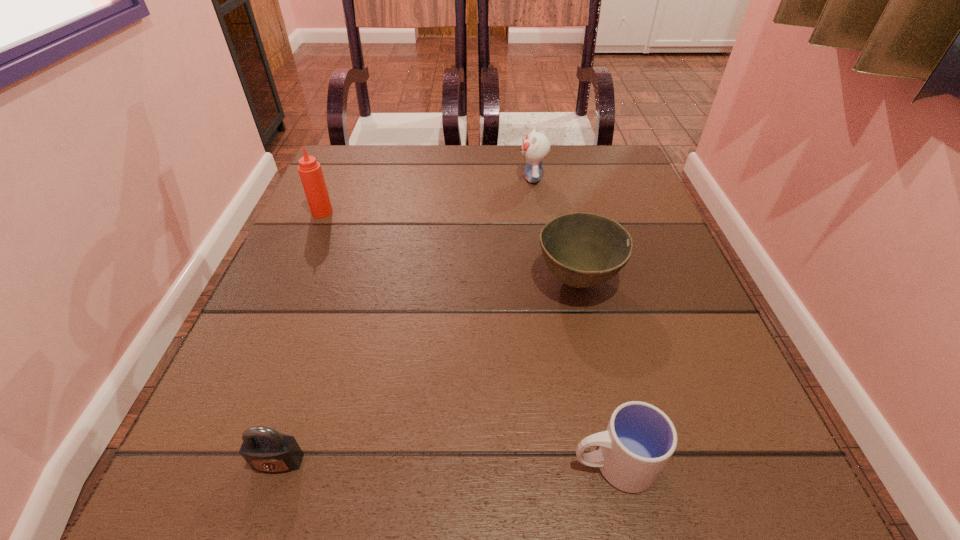
You are a GUI agent. You are given a task and a screenshot of the screen. Output one action in this format:
    pyautogui.click(x=<x>, y=<y>)
    Task: Click on the padlock situated at the left edge
    The image size is (960, 540).
    Given the screenshot: What is the action you would take?
    pyautogui.click(x=264, y=449)

Identify the location of bowl that is positioned at the right edge. The height and width of the screenshot is (540, 960). tap(582, 250).

Identify the location of cup at the right edge. Image resolution: width=960 pixels, height=540 pixels. (640, 439).

You are a GUI agent. You are given a task and a screenshot of the screen. Output one action in this format:
    pyautogui.click(x=<x>, y=<y>)
    Task: Click on the object at the near left corner
    The width and height of the screenshot is (960, 540).
    Given the screenshot: What is the action you would take?
    pyautogui.click(x=264, y=449)

You are a GUI agent. You are given a task and a screenshot of the screen. Output one action in this format:
    pyautogui.click(x=<x>, y=<y>)
    Task: Click on the object present at the near right corner
    Image resolution: width=960 pixels, height=540 pixels.
    Given the screenshot: What is the action you would take?
    pyautogui.click(x=640, y=439)

Where is `vacant space at the far edge of the desktop`? This screenshot has width=960, height=540. vacant space at the far edge of the desktop is located at coordinates tap(418, 161).

Identify the location of vacant position at the near edge of the desktop. coord(419,453).

This screenshot has width=960, height=540. In the image, there is a desktop. Find the location of `vacant space at the left edge`. vacant space at the left edge is located at coordinates (256, 415).

Identify the location of free space at the right edge of the desktop. The image size is (960, 540). (699, 364).

Image resolution: width=960 pixels, height=540 pixels. In order to click on vacant space at the far left corner of the desktop in this screenshot , I will do `click(363, 165)`.